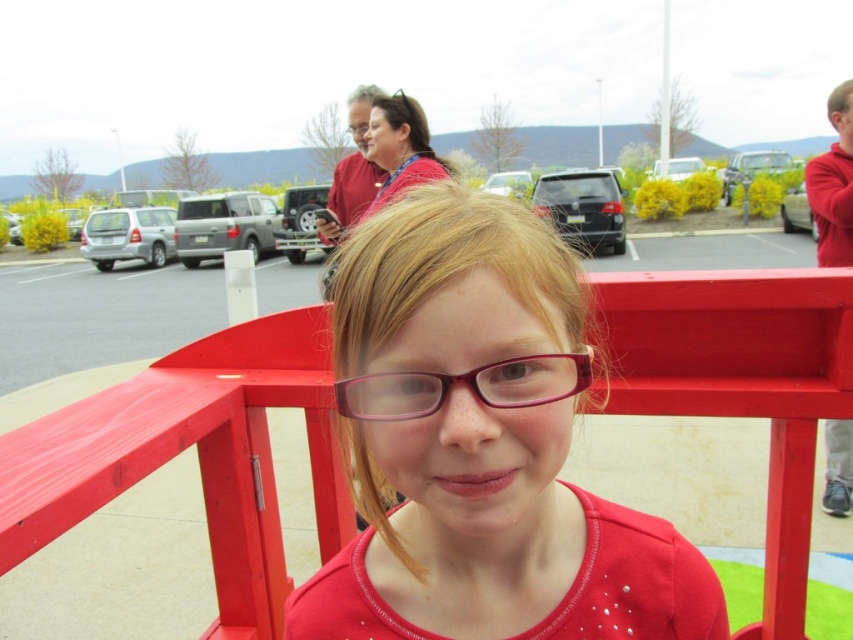
From the picture: Who is lower down, matte plastic rail at center or pink plastic glasses at center?

Positioned lower is matte plastic rail at center.

Who is higher up, matte plastic rail at center or pink plastic glasses at center?

pink plastic glasses at center is above.

What do you see at coordinates (196, 454) in the screenshot?
I see `matte plastic rail at center` at bounding box center [196, 454].

In order to click on matte plastic rail at center in this screenshot , I will do pos(196,454).

Does matte plastic glasses at center have a lesser height compared to pink plastic glasses at center?

No, matte plastic glasses at center is not shorter than pink plastic glasses at center.

Who is shorter, matte plastic glasses at center or pink plastic glasses at center?

With less height is pink plastic glasses at center.

The image size is (853, 640). What do you see at coordinates (480, 445) in the screenshot? I see `matte plastic glasses at center` at bounding box center [480, 445].

Where is `matte plastic glasses at center`? This screenshot has height=640, width=853. matte plastic glasses at center is located at coordinates (480, 445).

Does matte plastic glasses at center have a smaller size compared to matte plastic rail at center?

Yes.

Is point (572, 355) positioned after point (785, 355)?

No, it is not.

Locate an element on the screen. matte plastic glasses at center is located at coordinates (480, 445).